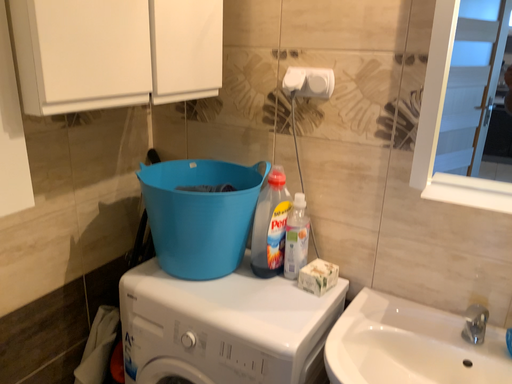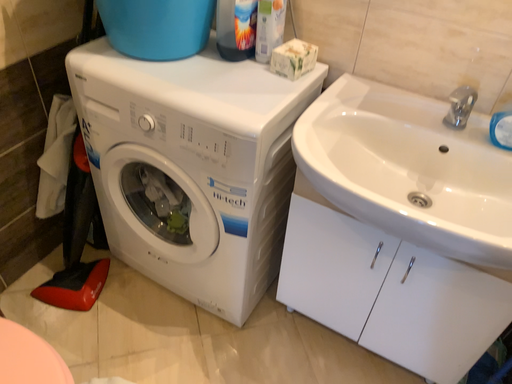
Question: How did the camera likely rotate when shooting the video?

Choices:
 (A) rotated upward
 (B) rotated downward

Answer: (B)